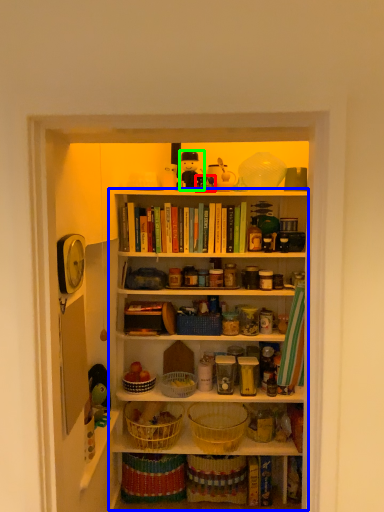
Question: Considering the real-world distances, which object is closest to toy (highlighted by a red box)? shelf (highlighted by a blue box) or toy (highlighted by a green box).

Choices:
 (A) shelf
 (B) toy

Answer: (B)